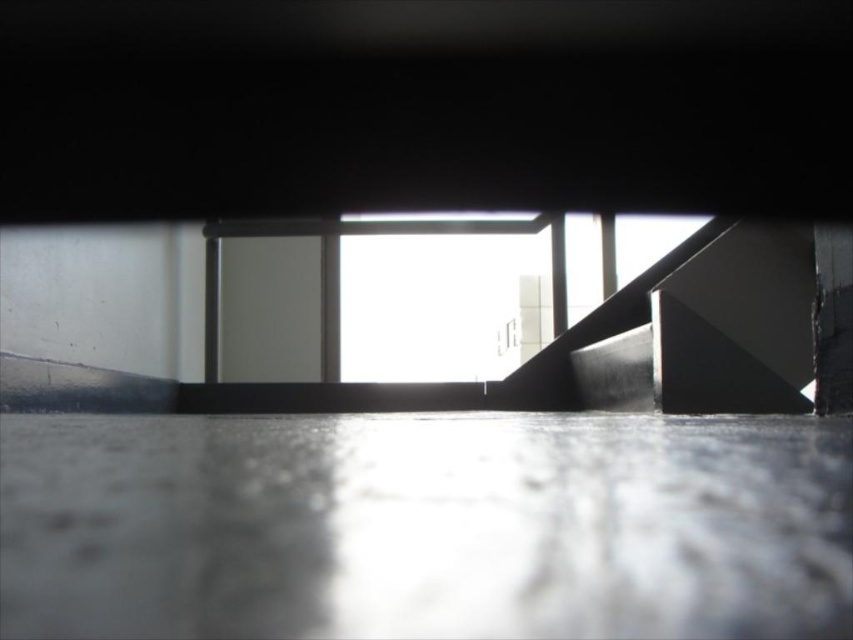
Consider the image. You are a painter who needs to move a large canvas that is 2 meters wide. You are standing on the matte black stair at right and want to carry the canvas through the transparent glass window at center. Can the canvas fit through the opening based on their widths?

The matte black stair at right is narrower than the transparent glass window at center, so the 2 meter wide canvas may not fit through the matte black stair at right. However, the transparent glass window at center is wider, so the canvas could potentially fit through it if the window opening is wide enough. However, the exact width of the window isn

You are standing at the bottom of a dark structure and see two points marked on the wall. The first point is at coordinates point (721,342) and the second is at point (222,253). Which point is closer to you?

Point (721,342) is in front of point (222,253), so it is closer to you.